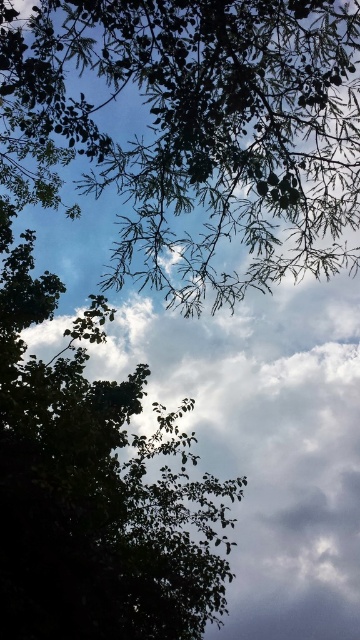
Who is higher up, green leafy branches at upper center or green leafy tree at center?

green leafy branches at upper center

Which is behind, point (88, 35) or point (29, 600)?

The point (88, 35) is more distant.

Describe the element at coordinates (200, 129) in the screenshot. The width and height of the screenshot is (360, 640). I see `green leafy branches at upper center` at that location.

This screenshot has height=640, width=360. Find the location of `green leafy branches at upper center`. green leafy branches at upper center is located at coordinates (200, 129).